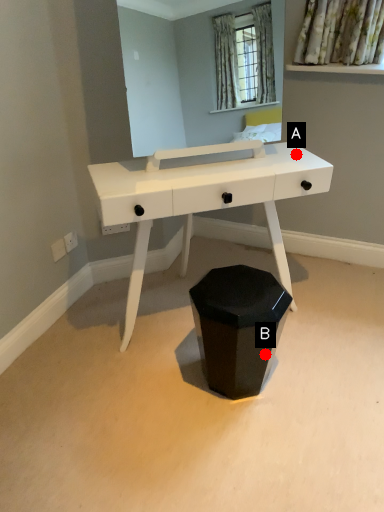
Question: Two points are circled on the image, labeled by A and B beside each circle. Which point is closer to the camera?

Choices:
 (A) A is closer
 (B) B is closer

Answer: (B)